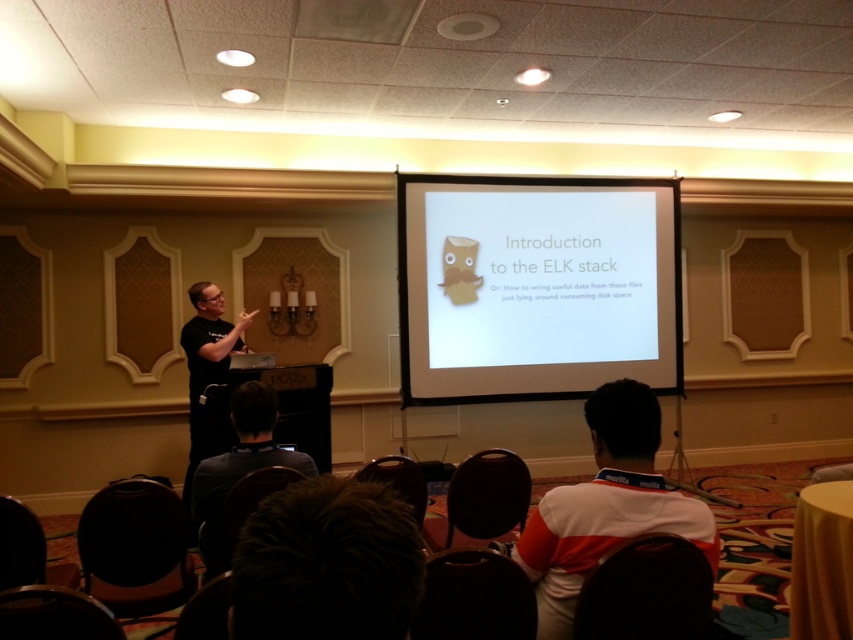
Question: Is dark gray shirt at lower center bigger than black matte shirt at left?

Choices:
 (A) yes
 (B) no

Answer: (B)

Question: Which of these objects is positioned farthest from the dark gray shirt at lower center?

Choices:
 (A) white striped shirt at lower center
 (B) black matte shirt at left

Answer: (B)

Question: Is white matte projector screen at center bigger than dark gray shirt at lower center?

Choices:
 (A) yes
 (B) no

Answer: (A)

Question: Which object is closer to the camera taking this photo?

Choices:
 (A) dark gray shirt at lower center
 (B) black matte shirt at left
 (C) white striped shirt at lower center
 (D) white matte projector screen at center

Answer: (C)

Question: Considering the relative positions of white striped shirt at lower center and black matte shirt at left in the image provided, where is white striped shirt at lower center located with respect to black matte shirt at left?

Choices:
 (A) below
 (B) above

Answer: (B)

Question: Which is farther from the white matte projector screen at center?

Choices:
 (A) dark gray shirt at lower center
 (B) black matte shirt at left
 (C) white striped shirt at lower center

Answer: (C)